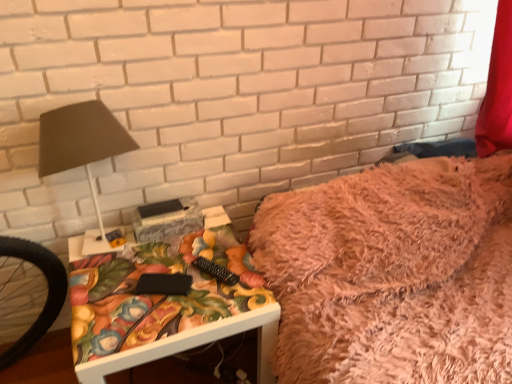
I want to click on vacant area that lies in front of matte black lamp at left, so click(114, 305).